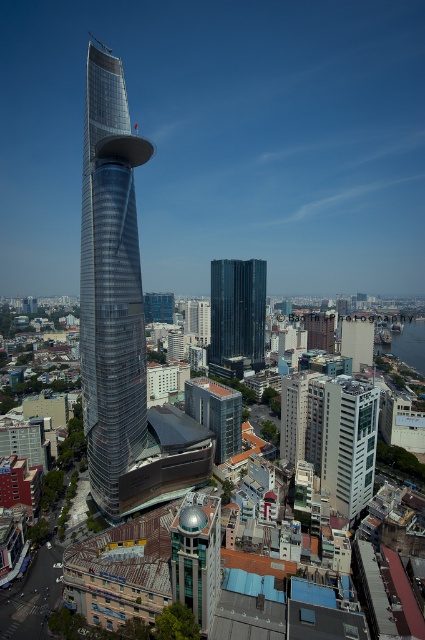
Question: Based on their relative distances, which object is farther from the black glass tower at center?

Choices:
 (A) shiny glass tower at center
 (B) white glass building at center

Answer: (B)

Question: Is white glass building at center positioned in front of black glass tower at center?

Choices:
 (A) yes
 (B) no

Answer: (A)

Question: Can you confirm if white glass building at center is positioned above black glass tower at center?

Choices:
 (A) no
 (B) yes

Answer: (A)

Question: In this image, where is shiny glass tower at center located relative to black glass tower at center?

Choices:
 (A) right
 (B) left

Answer: (B)

Question: Which of these objects is positioned closest to the white glass building at center?

Choices:
 (A) black glass tower at center
 (B) shiny glass tower at center

Answer: (B)

Question: Which point is farther to the camera?

Choices:
 (A) black glass tower at center
 (B) white glass building at center

Answer: (A)